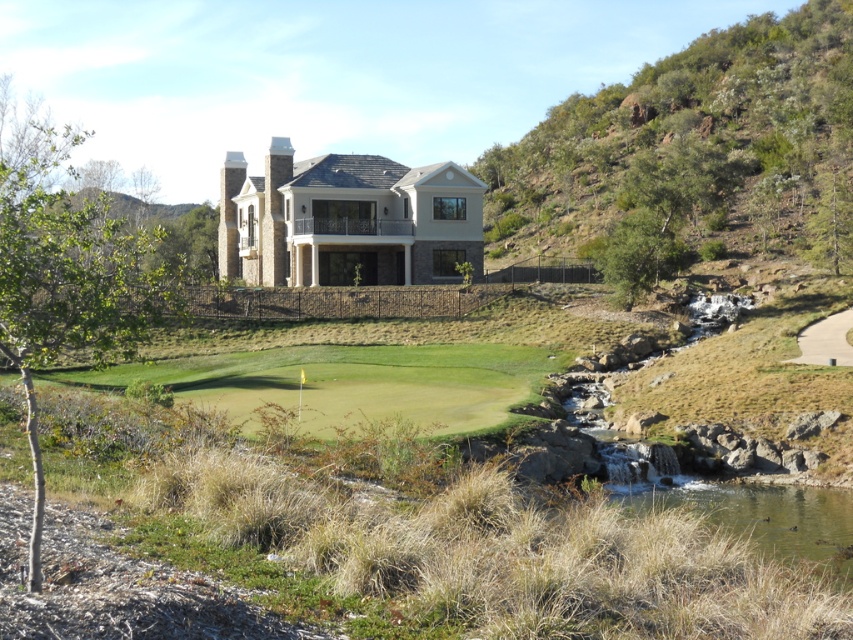
You are a landscape architect planning to install a new pathway between the beige stone mansion at center and the green grassy pond at lower right. Considering their sizes, which object requires more space to accommodate the pathway?

The beige stone mansion at center requires more space because its width is larger than the green grassy pond at lower right.

You are a landscape architect designing a new garden path that needs to connect the green leafy hillside at upper right and the green grassy pond at lower right. Considering their heights, which direction should the path slope towards?

The path should slope towards the green grassy pond at lower right because the green leafy hillside at upper right is much taller, so the elevation decreases from the hillside to the pond.

You are standing at the base of the hill where the small waterfall is located. You want to take a photo of the beige stone mansion at center from the best possible angle. According to the coordinates provided, where should you position yourself relative to the mansion to capture it in the frame?

The beige stone mansion at center is located at coordinates point (346,220). To capture it in the frame from the waterfall location, position yourself directly facing the mansion as it is centrally positioned in the scene.